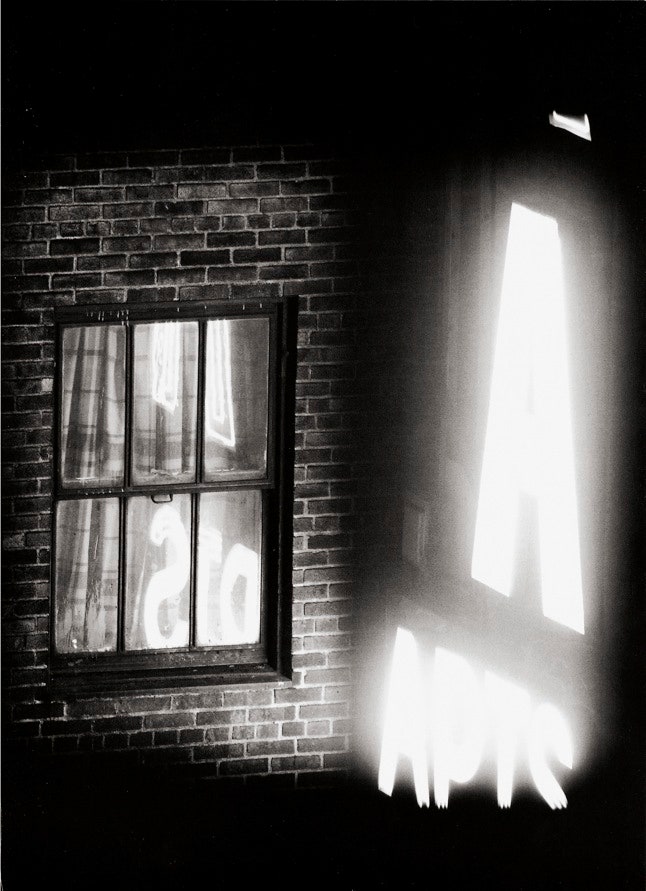
Locate an element on the screen. The width and height of the screenshot is (646, 891). neon letter a is located at coordinates (513, 395).